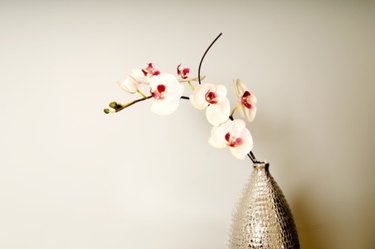
Identify the location of wall. (299, 52).